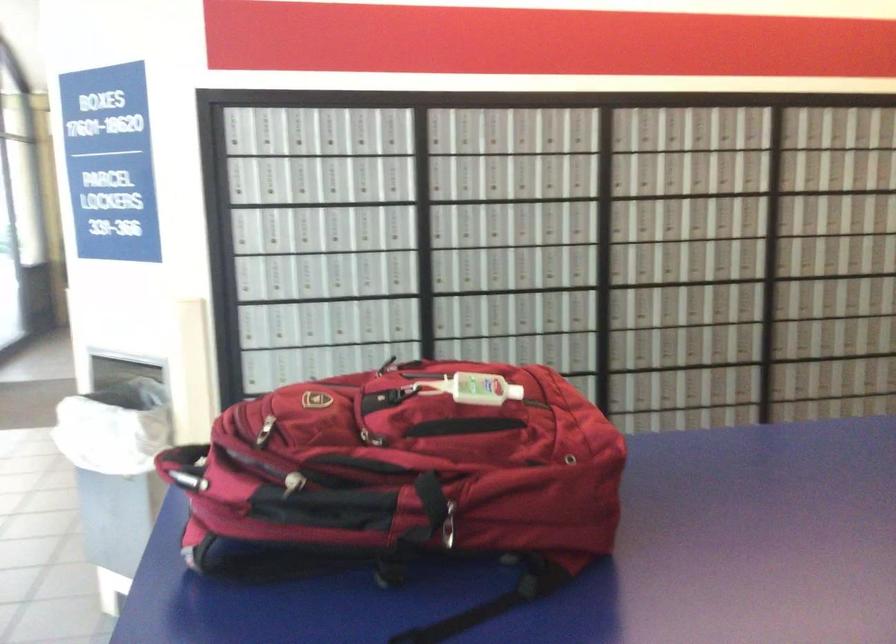
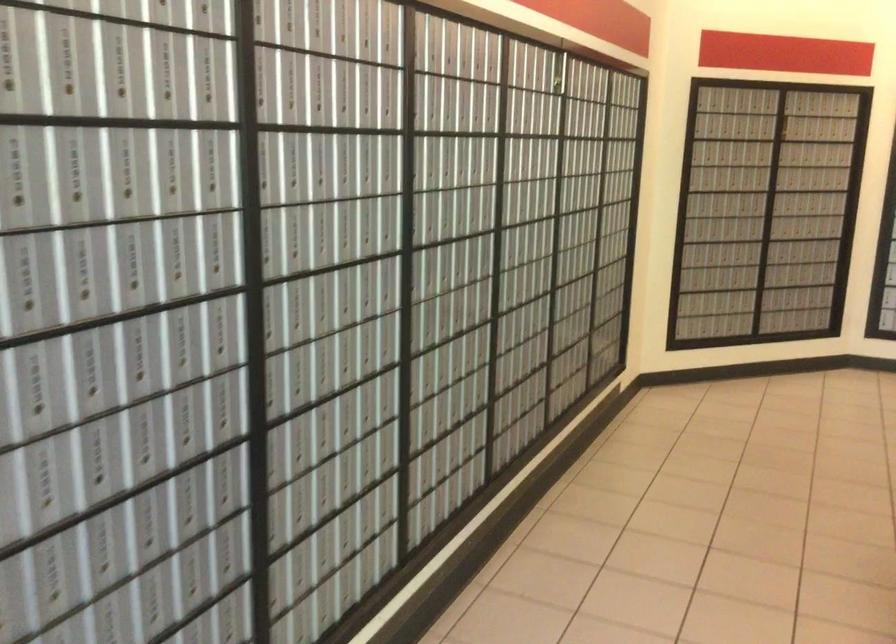
Locate, in the second image, the point that corresponds to pixel 321 292 in the first image.

(110, 313)